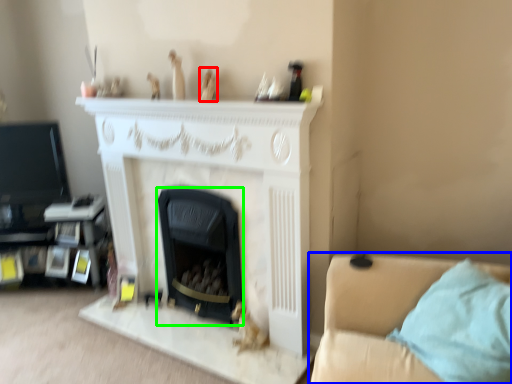
Question: Based on their relative distances, which object is nearer to toy (highlighted by a red box)? Choose from studio couch (highlighted by a blue box) and fireplace (highlighted by a green box).

Choices:
 (A) studio couch
 (B) fireplace

Answer: (B)